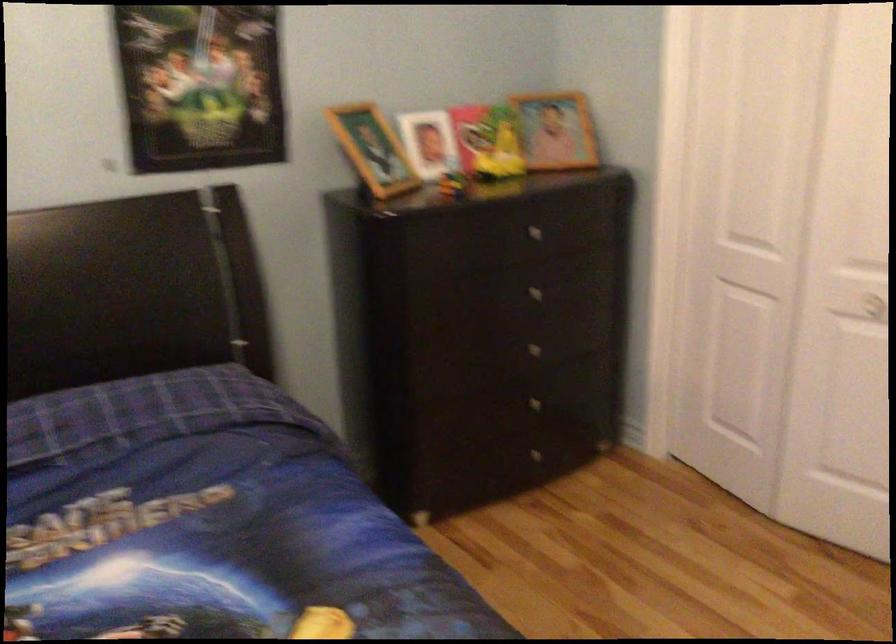
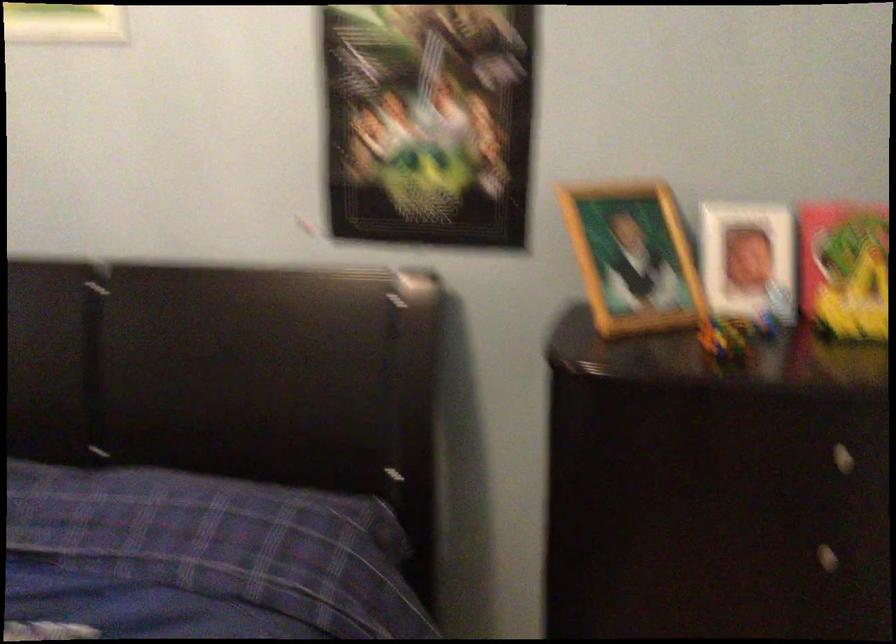
Find the pixel in the second image that matches (x=429, y=142) in the first image.

(748, 261)